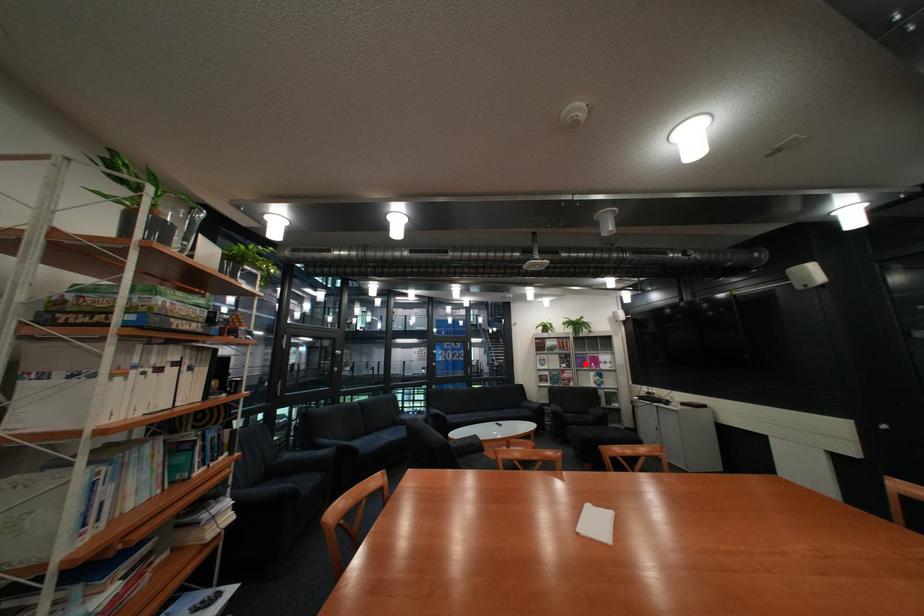
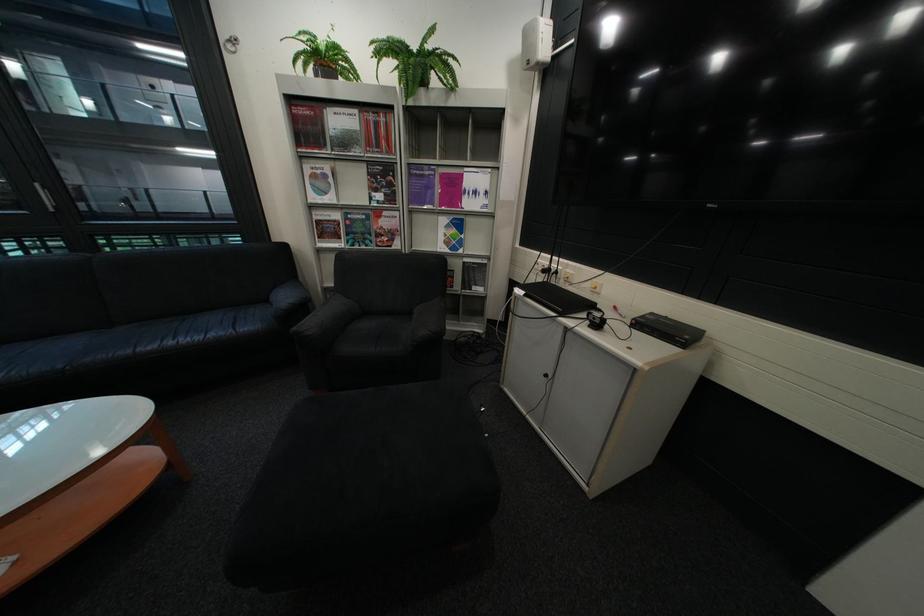
Where in the second image is the point corresponding to the highlighted location from the first image?

(409, 192)